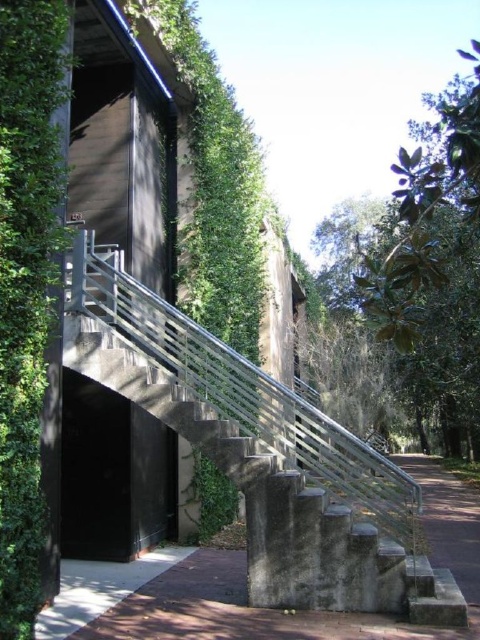
Question: Which of the following is the farthest from the observer?

Choices:
 (A) (456, 595)
 (B) (452, 428)

Answer: (B)

Question: Can you confirm if concrete/stone stairs at center is bigger than green leafy tree at upper right?

Choices:
 (A) yes
 (B) no

Answer: (B)

Question: Does concrete/stone stairs at center lie in front of green leafy tree at upper right?

Choices:
 (A) no
 (B) yes

Answer: (A)

Question: Which of the following is the farthest from the observer?

Choices:
 (A) (297, 496)
 (B) (393, 292)

Answer: (A)

Question: Does concrete/stone stairs at center have a larger size compared to green leafy tree at upper right?

Choices:
 (A) no
 (B) yes

Answer: (A)